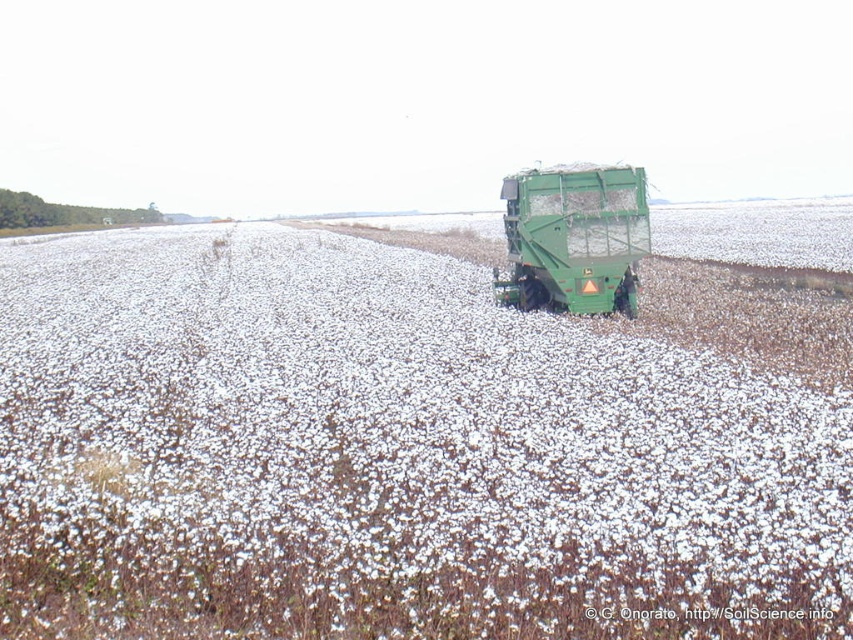
Does white fluffy cotton at center have a lesser height compared to green matte truck at center?

No, white fluffy cotton at center is not shorter than green matte truck at center.

Which is above, white fluffy cotton at center or green matte truck at center?

green matte truck at center is above.

Is point (701, 372) positioned behind point (549, 234)?

No, (701, 372) is in front of (549, 234).

You are a GUI agent. You are given a task and a screenshot of the screen. Output one action in this format:
    pyautogui.click(x=<x>, y=<y>)
    Task: Click on the white fluffy cotton at center
    The height and width of the screenshot is (640, 853).
    Given the screenshot: What is the action you would take?
    click(387, 456)